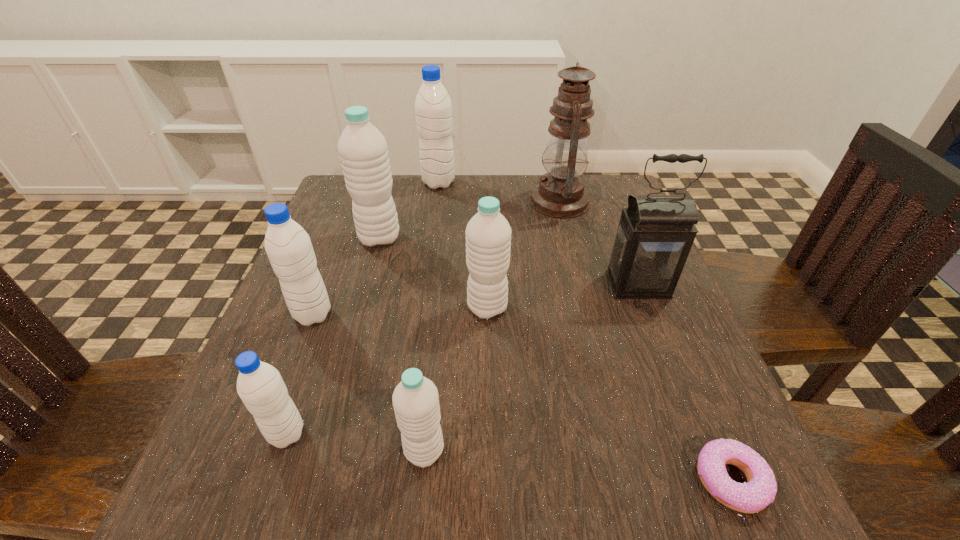
Identify which gray water bottle is located as the nearest to the smallest gray water bottle. Please provide its 2D coordinates. Your answer should be formatted as a tuple, i.e. [(x, y)], where the tuple contains the x and y coordinates of a point satisfying the conditions above.

[(288, 246)]

Select which white water bottle appears as the third closest to the shortest object. Please provide its 2D coordinates. Your answer should be formatted as a tuple, i.e. [(x, y)], where the tuple contains the x and y coordinates of a point satisfying the conditions above.

[(363, 150)]

Point out which white water bottle is positioned as the second nearest to the farthest gray water bottle. Please provide its 2D coordinates. Your answer should be formatted as a tuple, i.e. [(x, y)], where the tuple contains the x and y coordinates of a point satisfying the conditions above.

[(488, 234)]

Where is `free space that satisfies the following two spatial constraints: 1. on the back side of the nearest gray water bottle; 2. on the left side of the second farthest water bottle`? Image resolution: width=960 pixels, height=540 pixels. free space that satisfies the following two spatial constraints: 1. on the back side of the nearest gray water bottle; 2. on the left side of the second farthest water bottle is located at coordinates (355, 238).

Locate an element on the screen. The height and width of the screenshot is (540, 960). free location that satisfies the following two spatial constraints: 1. on the back side of the smallest gray water bottle; 2. on the left side of the second smallest white water bottle is located at coordinates click(331, 308).

Image resolution: width=960 pixels, height=540 pixels. I want to click on free spot that satisfies the following two spatial constraints: 1. on the back side of the oil lamp; 2. on the left side of the nearest white water bottle, so click(x=448, y=202).